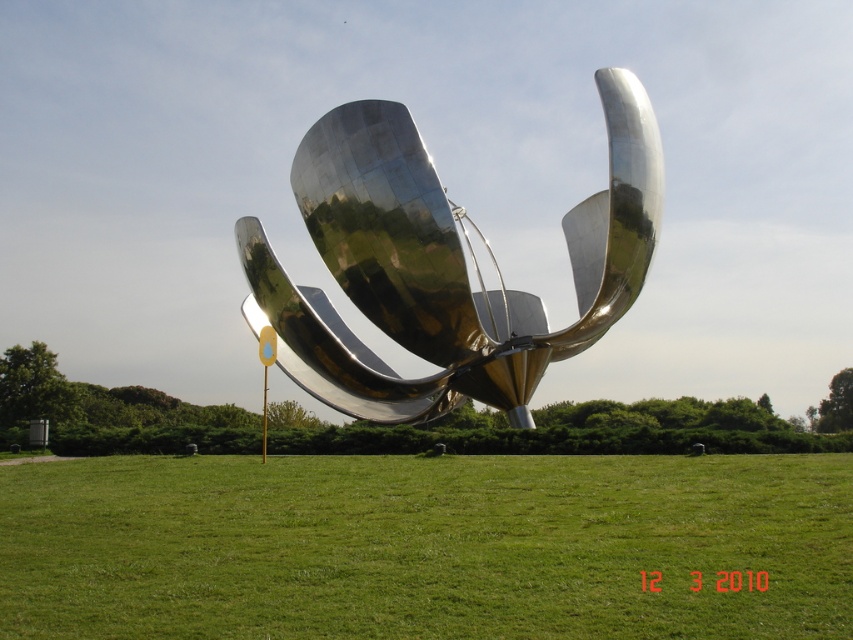
Question: Observing the image, what is the correct spatial positioning of green grass at center in reference to shiny metallic flower at center?

Choices:
 (A) left
 (B) right

Answer: (B)

Question: Is green grass at center bigger than shiny metallic flower at center?

Choices:
 (A) no
 (B) yes

Answer: (A)

Question: Which object is closer to the camera taking this photo?

Choices:
 (A) shiny metallic flower at center
 (B) green grass at center

Answer: (B)

Question: Which point is closer to the camera taking this photo?

Choices:
 (A) (474, 324)
 (B) (15, 538)

Answer: (B)

Question: Can you confirm if green grass at center is positioned below shiny metallic flower at center?

Choices:
 (A) no
 (B) yes

Answer: (B)